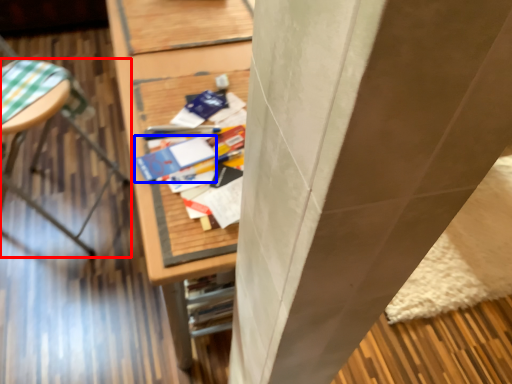
Question: Which object appears farthest to the camera in this image, furniture (highlighted by a red box) or paperback book (highlighted by a blue box)?

Choices:
 (A) furniture
 (B) paperback book

Answer: (A)